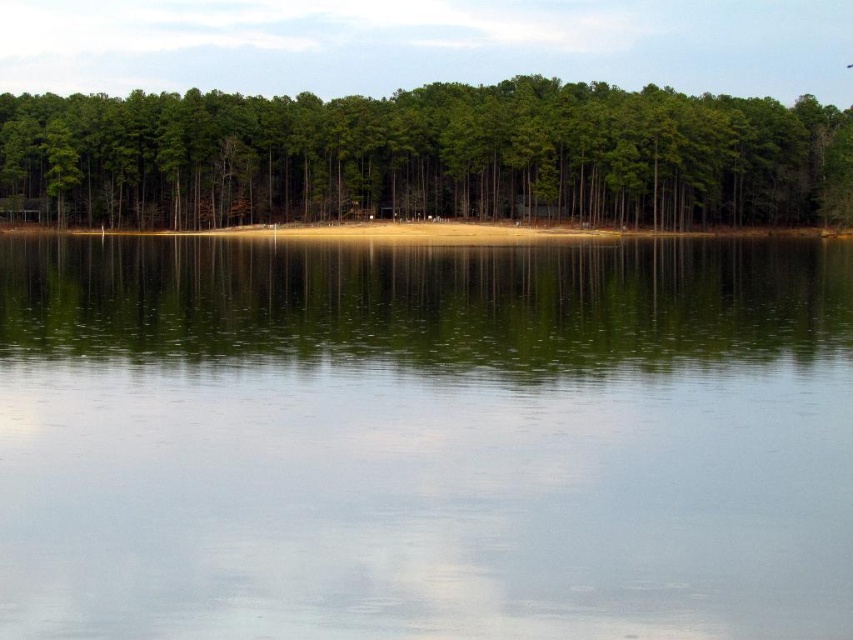
You are planning to build a dock on the lakeside. The dock needs to be at least 200 feet away from the green matte trees at upper center to comply with environmental regulations. Can the green reflective water at center, which is where you want to place the dock, meet this requirement?

The distance between the green reflective water at center and the green matte trees at upper center is 212.73 feet, which exceeds the 200 feet requirement. Therefore, placing the dock at the green reflective water at center complies with the environmental regulations.

You are standing at the lakeside and notice the green reflective water at center and the green matte trees at upper center. Which object is positioned to the left of the other?

The green reflective water at center is to the left of green matte trees at upper center.

You are standing at the lakeside and see a point marked at coordinates (x=424, y=440). What does this point indicate?

The point at coordinates (x=424, y=440) marks the location of green reflective water at center.